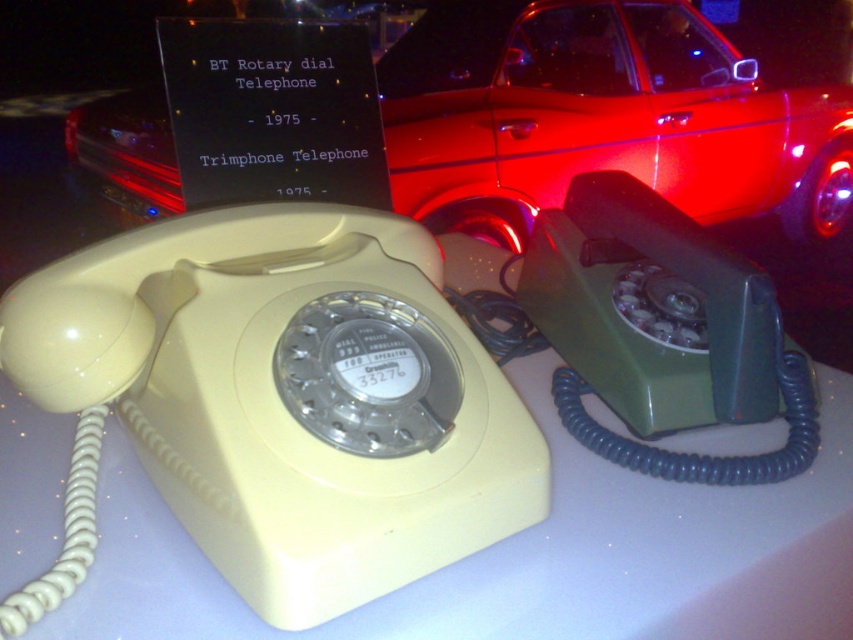
Question: Which object appears farthest from the camera in this image?

Choices:
 (A) metallic red car at upper center
 (B) white plastic table at center

Answer: (A)

Question: From the image, what is the correct spatial relationship of white plastic table at center in relation to matte green rotary dial telephone at right?

Choices:
 (A) right
 (B) left

Answer: (B)

Question: Which object is the closest to the matte green rotary dial telephone at right?

Choices:
 (A) metallic red car at upper center
 (B) white plastic table at center

Answer: (B)

Question: Is metallic red car at upper center positioned at the back of matte green rotary dial telephone at right?

Choices:
 (A) yes
 (B) no

Answer: (A)

Question: Considering the relative positions of metallic red car at upper center and matte green rotary dial telephone at right in the image provided, where is metallic red car at upper center located with respect to matte green rotary dial telephone at right?

Choices:
 (A) below
 (B) above

Answer: (B)

Question: Which point is farther to the camera?

Choices:
 (A) metallic red car at upper center
 (B) matte green rotary dial telephone at right

Answer: (A)